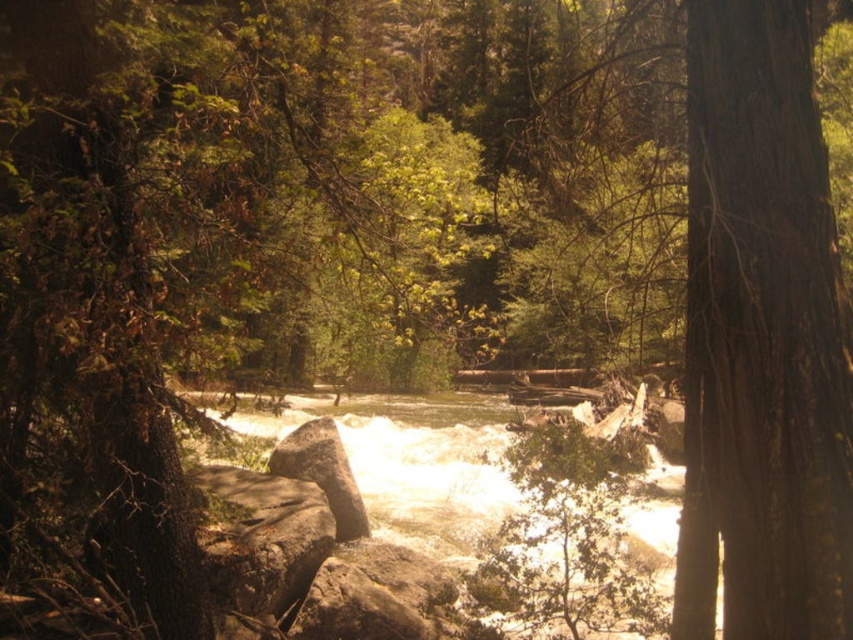
Is brown rough rock at center positioned at the back of rough textured rock at center?

That is True.

Between brown rough rock at center and rough textured rock at center, which one appears on the left side from the viewer's perspective?

brown rough rock at center

Which is behind, point (236, 532) or point (392, 611)?

Positioned behind is point (236, 532).

The image size is (853, 640). Identify the location of brown rough rock at center. click(x=260, y=538).

Is the position of smooth brown tree trunk at right less distant than that of gray rough boulder at center?

Yes, smooth brown tree trunk at right is closer to the viewer.

Which is below, smooth brown tree trunk at right or gray rough boulder at center?

gray rough boulder at center is below.

Which is in front, point (720, 38) or point (344, 513)?

Point (720, 38)

Locate an element on the screen. The image size is (853, 640). smooth brown tree trunk at right is located at coordinates (761, 339).

Is smooth brown tree trunk at right wider than white frothy water at center?

In fact, smooth brown tree trunk at right might be narrower than white frothy water at center.

I want to click on smooth brown tree trunk at right, so click(761, 339).